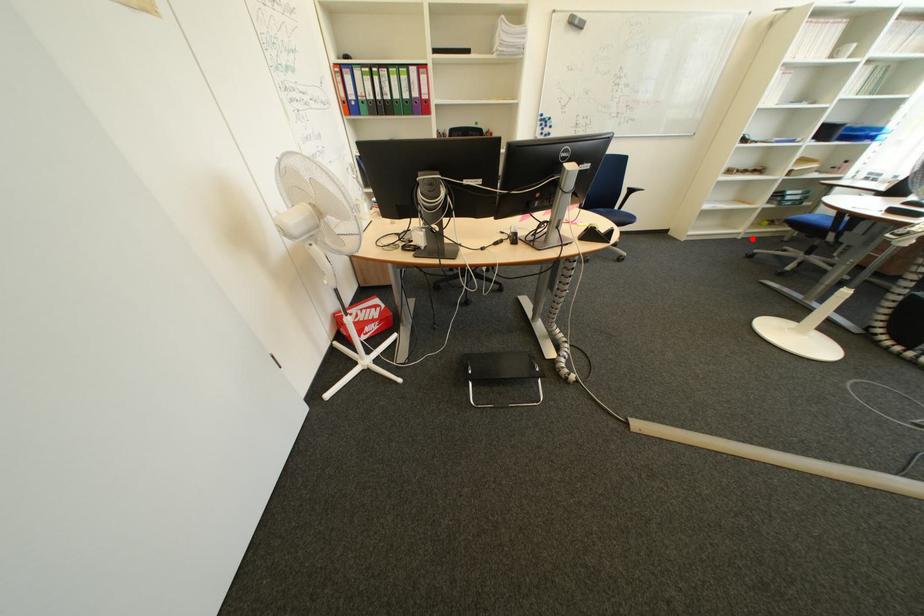
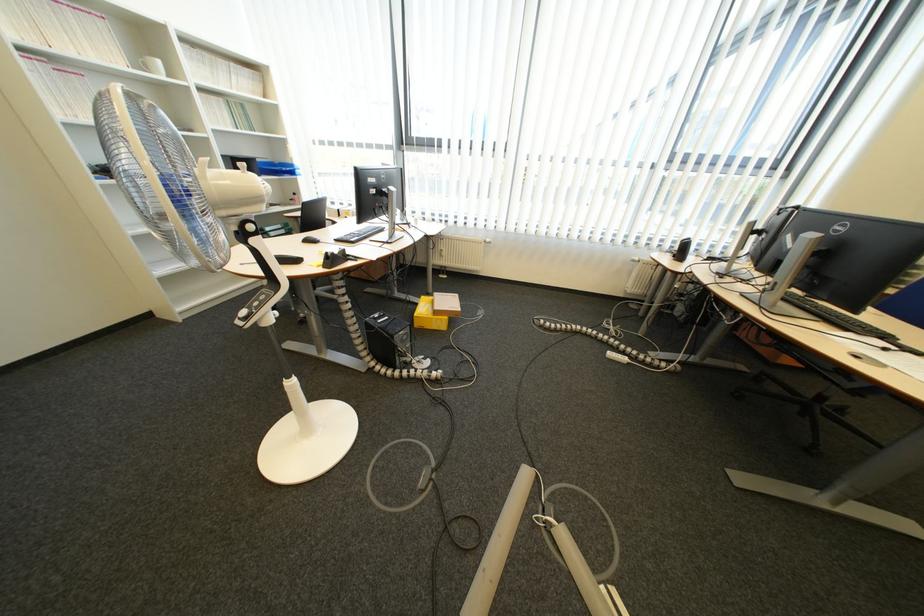
Question: I am providing you with two images of the same scene from different viewpoints. A red point is shown in image1. For the corresponding object point in image2, is it positioned nearer or farther from the camera?

Choices:
 (A) Nearer
 (B) Farther

Answer: (B)